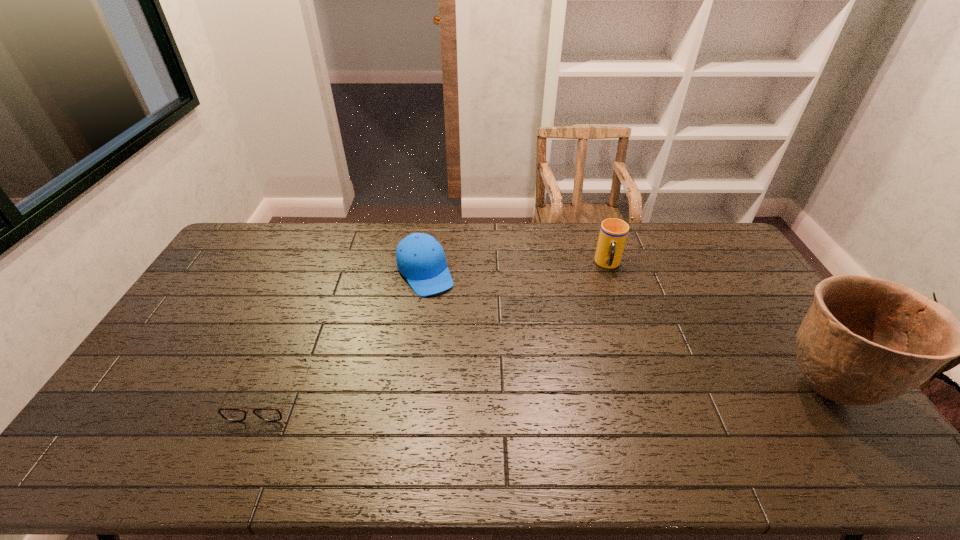
Image resolution: width=960 pixels, height=540 pixels. In order to click on free space located on the front-facing side of the third object from right to left in this screenshot , I will do `click(489, 381)`.

Where is `free space located 0.380m on the front-facing side of the third object from right to left`? Image resolution: width=960 pixels, height=540 pixels. free space located 0.380m on the front-facing side of the third object from right to left is located at coordinates (488, 379).

Find the location of `blank area located 0.090m on the side of the second tallest object with the handle`. blank area located 0.090m on the side of the second tallest object with the handle is located at coordinates (611, 294).

This screenshot has height=540, width=960. What are the coordinates of `vacant point located 0.140m on the side of the second tallest object with the handle` in the screenshot? It's located at (611, 303).

This screenshot has width=960, height=540. Find the location of `blank space located 0.270m on the side of the second tallest object with the handle`. blank space located 0.270m on the side of the second tallest object with the handle is located at coordinates (612, 333).

Where is `cap that is positioned at the far edge`? The width and height of the screenshot is (960, 540). cap that is positioned at the far edge is located at coordinates (420, 258).

This screenshot has width=960, height=540. In order to click on cup present at the far edge in this screenshot , I will do `click(613, 233)`.

Where is `sunglasses that is at the near edge`? sunglasses that is at the near edge is located at coordinates (231, 414).

At what (x,y) coordinates should I click in order to perform the action: click on pottery that is positioned at the near edge. Please return your answer as a coordinate pair (x, y). Image resolution: width=960 pixels, height=540 pixels. Looking at the image, I should click on (864, 341).

At what (x,y) coordinates should I click in order to perform the action: click on object that is at the right edge. Please return your answer as a coordinate pair (x, y). The image size is (960, 540). Looking at the image, I should click on (864, 341).